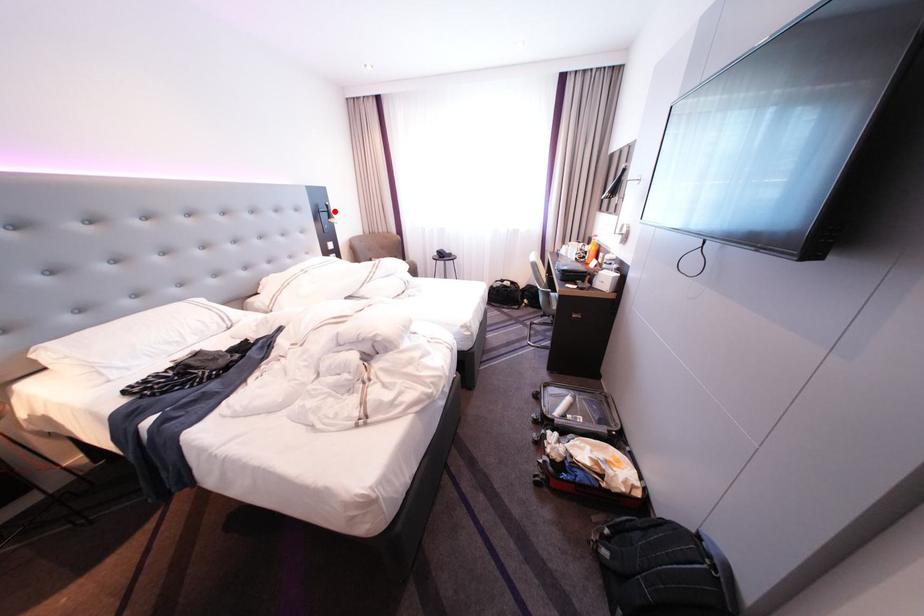
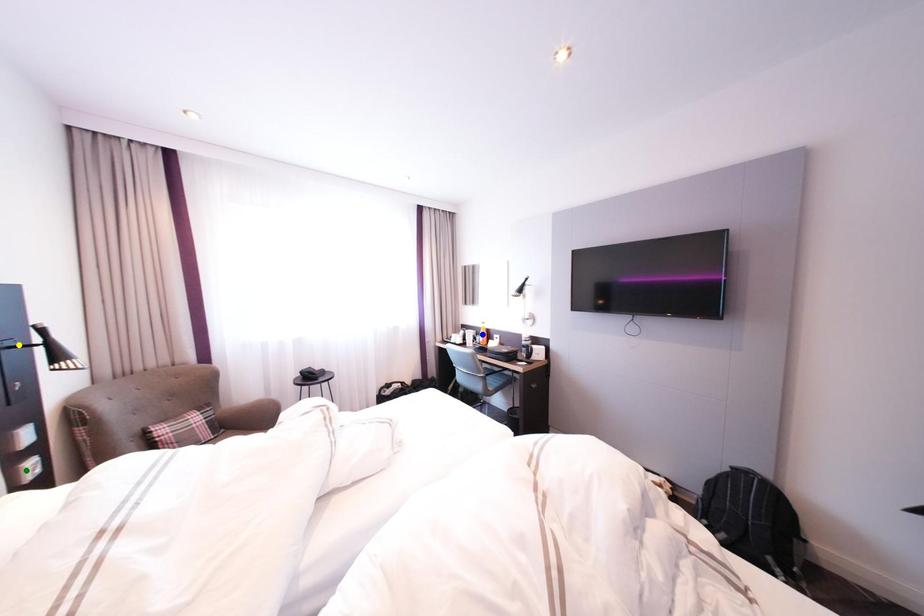
Question: I am providing you with two images of the same scene from different viewpoints. A red point is marked on the first image. You are given multiple points on the second image. Which point in image 2 is actually the same real-world point as the red point in image 1?

Choices:
 (A) green point
 (B) blue point
 (C) yellow point

Answer: (C)